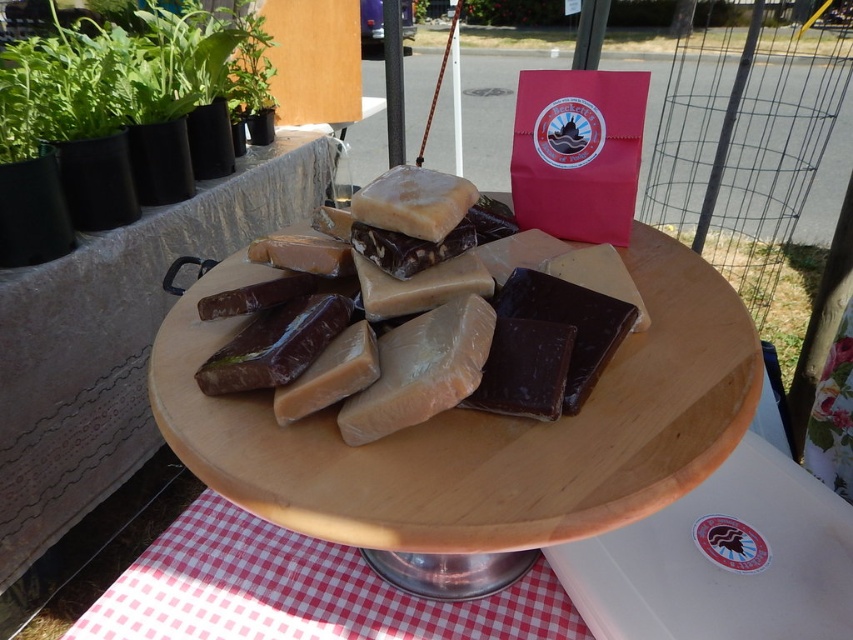
Is point (204, 243) positioned before point (409, 296)?

No.

Where is `translucent plastic tray at center`? Image resolution: width=853 pixels, height=640 pixels. translucent plastic tray at center is located at coordinates (115, 340).

Does wooden tray at center lie in front of matte brown chocolate bar at center?

Yes.

Is wooden tray at center wider than matte brown chocolate bar at center?

Indeed, wooden tray at center has a greater width compared to matte brown chocolate bar at center.

Between point (268, 435) and point (273, 285), which one is positioned behind?

Positioned behind is point (273, 285).

In order to click on wooden tray at center in this screenshot , I will do `click(480, 429)`.

Between dark brown chocolate bar at center and matte brown chocolate bar at center, which one has more height?

dark brown chocolate bar at center is taller.

Between point (552, 342) and point (222, 307), which one is positioned behind?

Positioned behind is point (222, 307).

You are a GUI agent. You are given a task and a screenshot of the screen. Output one action in this format:
    pyautogui.click(x=<x>, y=<y>)
    Task: Click on the dark brown chocolate bar at center
    This screenshot has height=640, width=853.
    Given the screenshot: What is the action you would take?
    pyautogui.click(x=524, y=369)